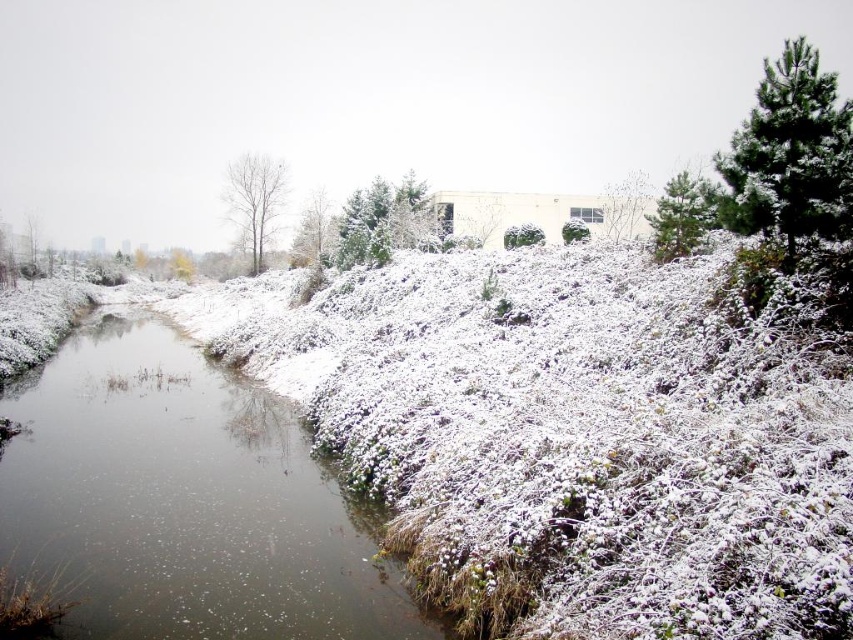
You are standing at the edge of the river and see the clear water at center and the green matte tree at center. Which object is closer to you?

The clear water at center is closer to the viewer than the green matte tree at center.